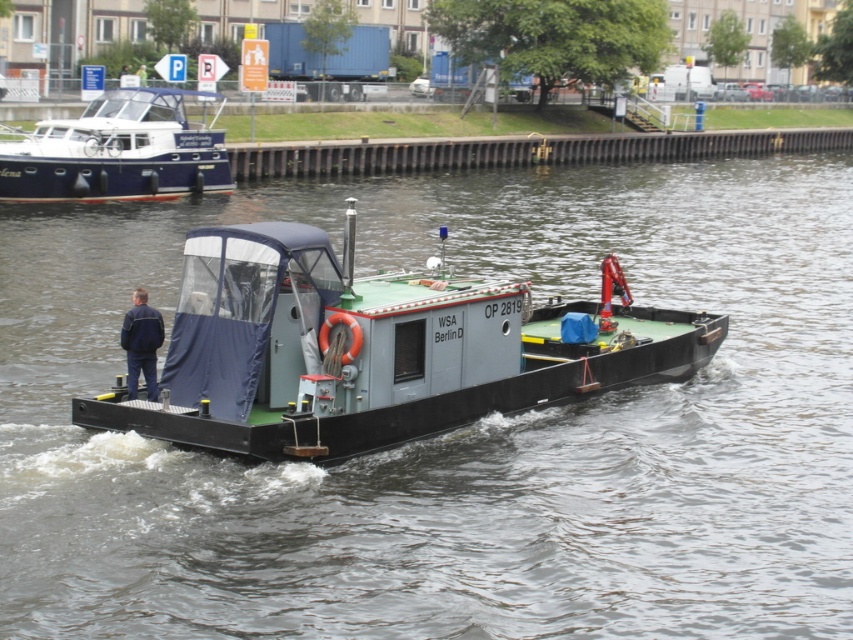
Between gray matte barge at center and navy blue jacket at left, which one has less height?

navy blue jacket at left is shorter.

Identify the location of gray matte barge at center. (376, 349).

Does gray matte barge at center appear on the left side of blue polished wood boat at upper left?

No, gray matte barge at center is not to the left of blue polished wood boat at upper left.

Image resolution: width=853 pixels, height=640 pixels. What do you see at coordinates (376, 349) in the screenshot?
I see `gray matte barge at center` at bounding box center [376, 349].

Which is behind, point (426, 371) or point (171, 99)?

The point (171, 99) is behind.

Image resolution: width=853 pixels, height=640 pixels. Identify the location of gray matte barge at center. (376, 349).

What do you see at coordinates (119, 150) in the screenshot?
I see `blue polished wood boat at upper left` at bounding box center [119, 150].

Which is behind, point (39, 147) or point (144, 380)?

Point (39, 147)

Is point (97, 168) behind point (138, 310)?

Yes.

Where is `blue polished wood boat at upper left`? blue polished wood boat at upper left is located at coordinates (119, 150).